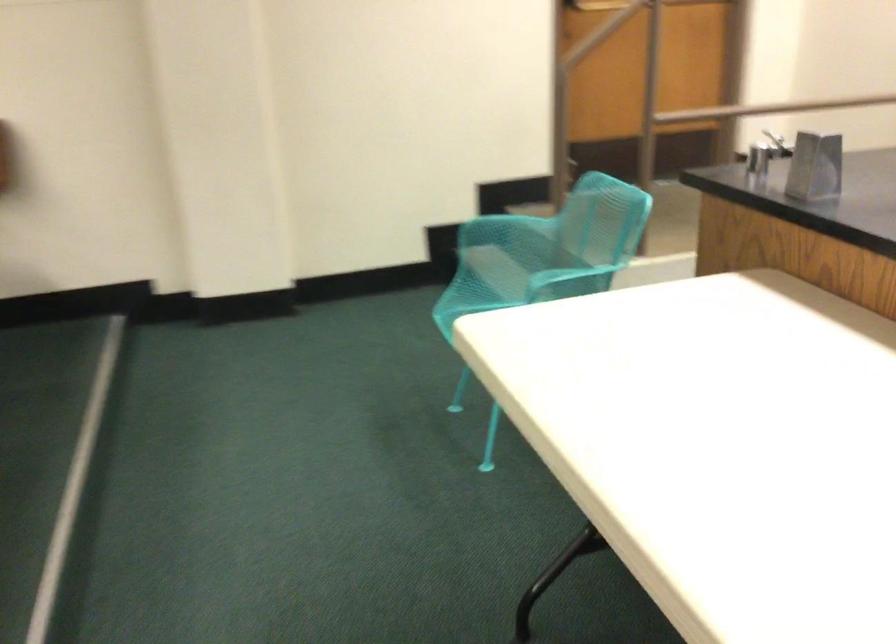
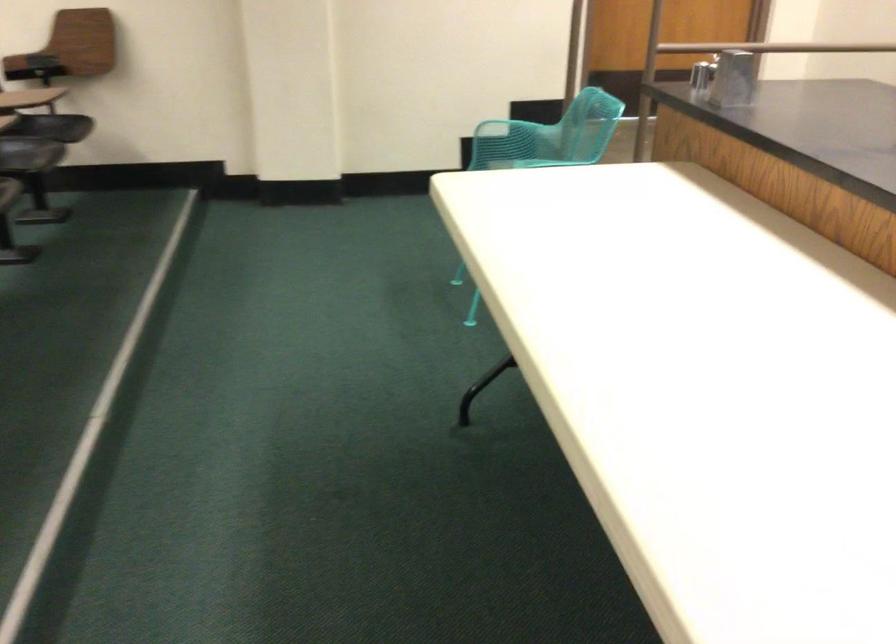
In the second image, find the point that corresponds to point (478, 256) in the first image.

(489, 158)